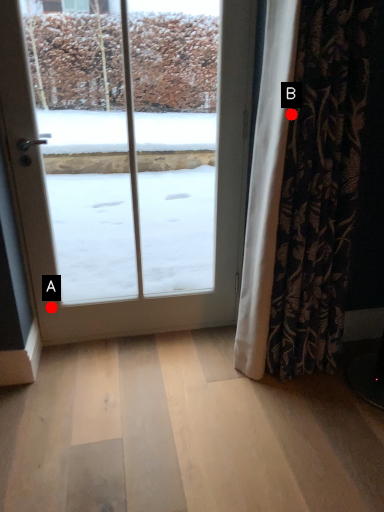
Question: Two points are circled on the image, labeled by A and B beside each circle. Which point is closer to the camera?

Choices:
 (A) A is closer
 (B) B is closer

Answer: (B)